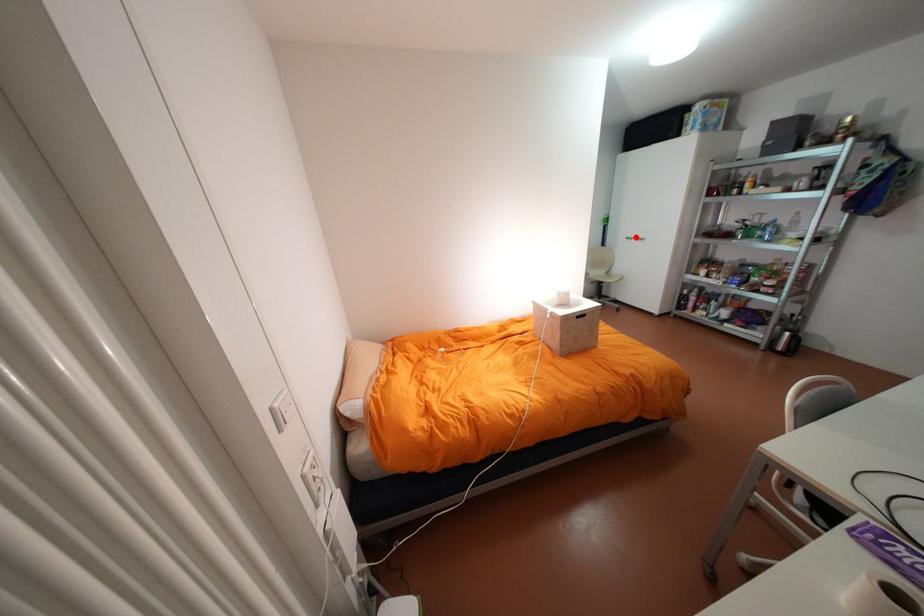
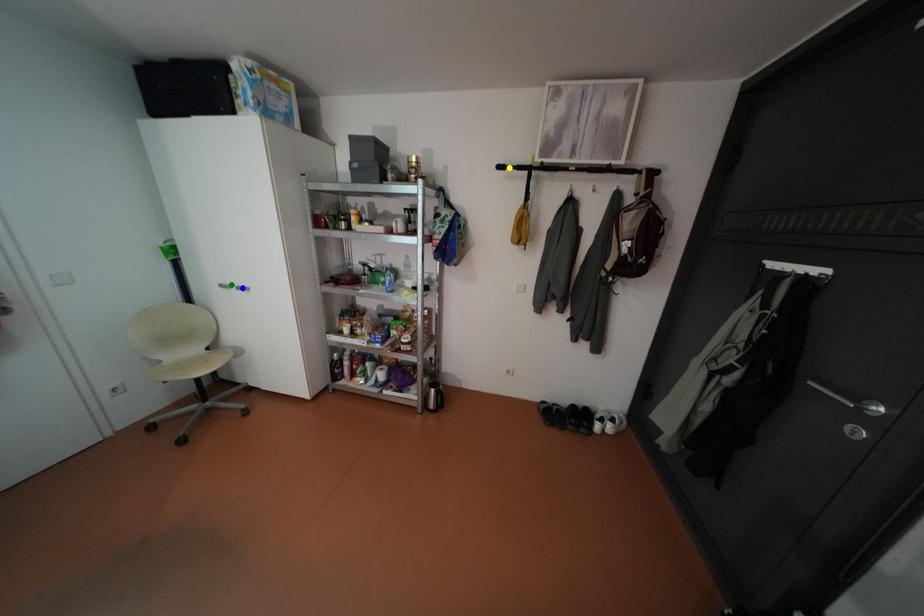
Question: I am providing you with two images of the same scene from different viewpoints. A red point is marked on the first image. You are given multiple points on the second image. Which spot in image 2 lines up with the point in image 1?

Choices:
 (A) blue point
 (B) yellow point
 (C) green point

Answer: (C)